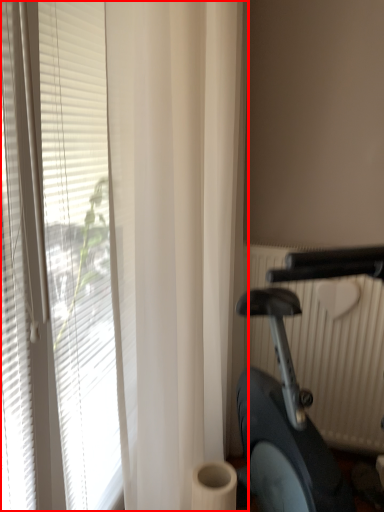
Question: Observing the image, what is the correct spatial positioning of window blind (annotated by the red box) in reference to stationary bicycle?

Choices:
 (A) right
 (B) left

Answer: (B)